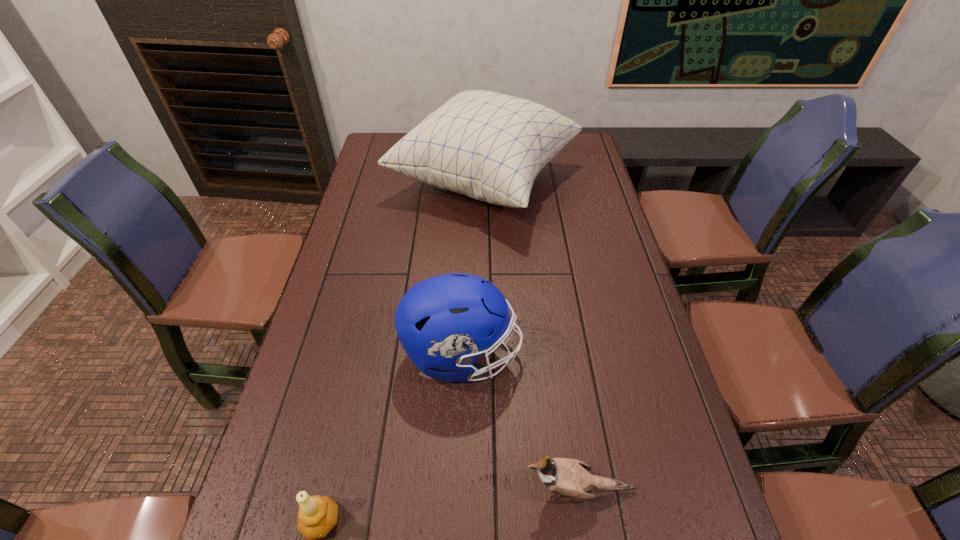
This screenshot has width=960, height=540. I want to click on object located at the far edge, so click(488, 146).

Where is `object located at the left edge`? object located at the left edge is located at coordinates (488, 146).

I want to click on cushion located at the right edge, so click(488, 146).

This screenshot has height=540, width=960. In order to click on bird located in the right edge section of the desktop in this screenshot , I will do `click(569, 478)`.

Where is `object located at the far left corner`? Image resolution: width=960 pixels, height=540 pixels. object located at the far left corner is located at coordinates (488, 146).

Locate an element on the screen. The height and width of the screenshot is (540, 960). object at the far right corner is located at coordinates (488, 146).

Image resolution: width=960 pixels, height=540 pixels. I want to click on free space at the left edge of the desktop, so click(x=347, y=283).

The image size is (960, 540). In order to click on vacant space at the right edge of the desktop in this screenshot , I will do `click(600, 176)`.

Image resolution: width=960 pixels, height=540 pixels. Find the location of `vacant space at the far left corner of the desktop`. vacant space at the far left corner of the desktop is located at coordinates (372, 151).

The width and height of the screenshot is (960, 540). What are the coordinates of `free space between the tallest object and the bird` in the screenshot? It's located at click(x=532, y=335).